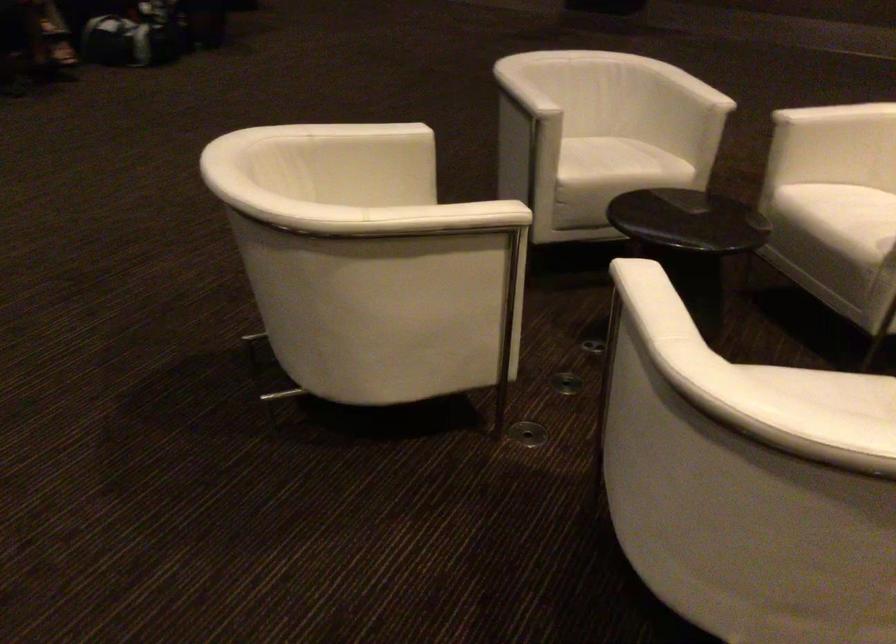
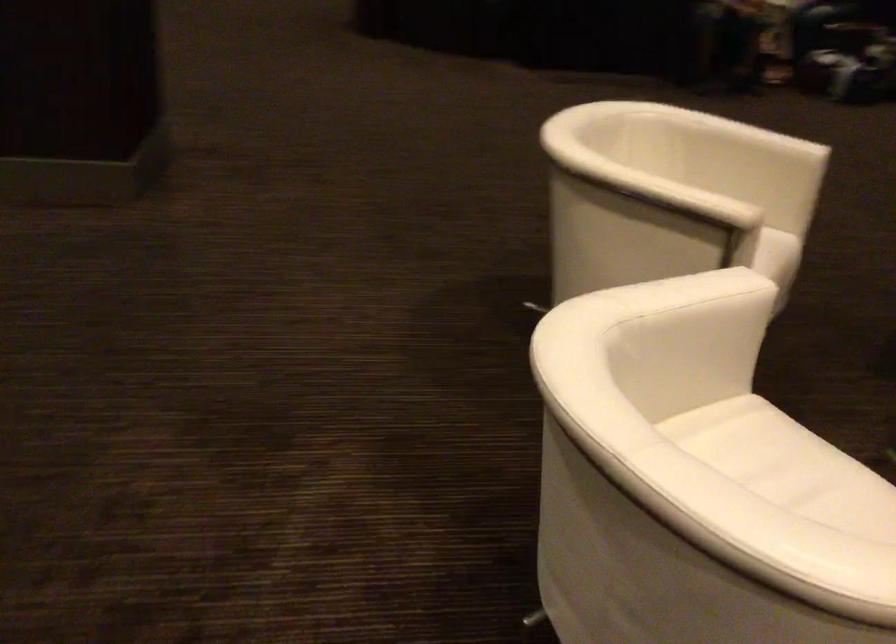
The point at [461,218] is marked in the first image. Where is the corresponding point in the second image?

(675, 194)